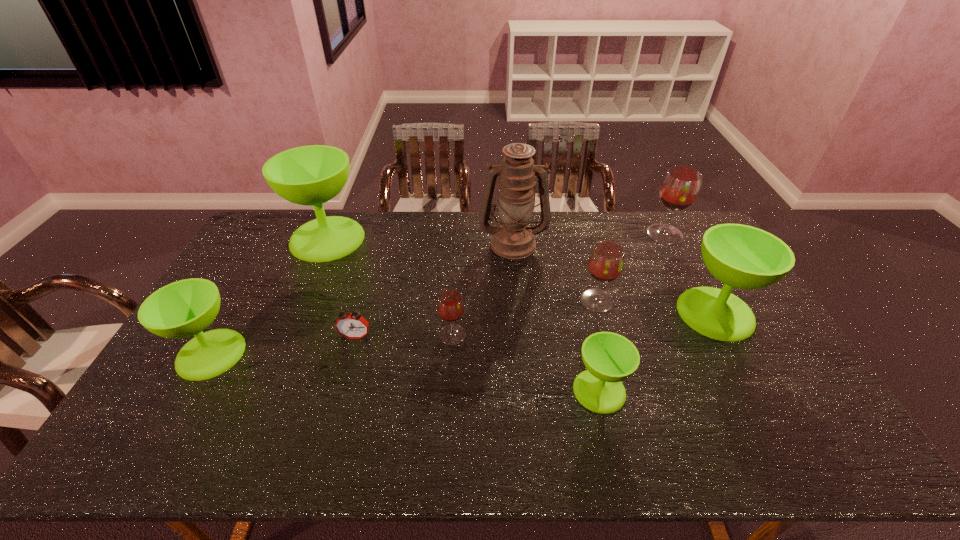
This screenshot has width=960, height=540. Identify the location of oil lamp. (513, 238).

Where is `the tallest wineglass`? The height and width of the screenshot is (540, 960). the tallest wineglass is located at coordinates (311, 175).

The width and height of the screenshot is (960, 540). Identify the location of the second tallest object. (311, 175).

Locate an element on the screen. The height and width of the screenshot is (540, 960). the biggest red wineglass is located at coordinates (680, 187).

This screenshot has height=540, width=960. In order to click on the farthest red wineglass in this screenshot , I will do `click(680, 187)`.

Where is `the rightmost green wineglass`? The image size is (960, 540). the rightmost green wineglass is located at coordinates (741, 256).

At what (x,y) coordinates should I click in order to perform the action: click on the second nearest red wineglass. Please return your answer as a coordinate pair (x, y). The image size is (960, 540). Looking at the image, I should click on (606, 261).

Where is `the second red wineglass from left to right`? This screenshot has width=960, height=540. the second red wineglass from left to right is located at coordinates (606, 261).

You are a GUI agent. You are given a task and a screenshot of the screen. Output one action in this format:
    pyautogui.click(x=<x>, y=<y>)
    Task: Click on the second smallest green wineglass
    Image resolution: width=960 pixels, height=540 pixels.
    Given the screenshot: What is the action you would take?
    pyautogui.click(x=181, y=309)

Image resolution: width=960 pixels, height=540 pixels. In order to click on the leftmost red wineglass in this screenshot , I will do [450, 305].